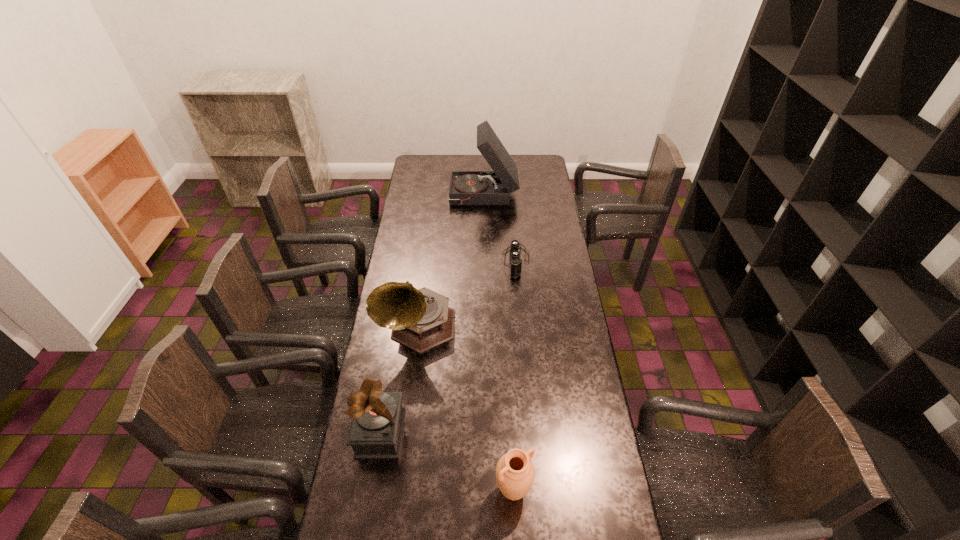
The height and width of the screenshot is (540, 960). Identify the location of object that is the fourth closest to the second farthest phonograph_record. (494, 187).

Where is `phonograph_record that is the second closest one to the binoculars`? The image size is (960, 540). phonograph_record that is the second closest one to the binoculars is located at coordinates (494, 187).

This screenshot has width=960, height=540. What are the coordinates of `phonograph_record that is the closest one to the farthest phonograph_record` in the screenshot? It's located at (420, 319).

Image resolution: width=960 pixels, height=540 pixels. In order to click on free region that satisfies the following two spatial constraints: 1. on the front-facing side of the farthest phonograph_record; 2. on the right side of the second farthest object in this screenshot , I will do (x=485, y=261).

This screenshot has height=540, width=960. In order to click on blank space that satisfies the following two spatial constraints: 1. on the back side of the second shortest object; 2. on the front-facing side of the tallest object in this screenshot , I will do `click(498, 196)`.

The image size is (960, 540). I want to click on vacant region that satisfies the following two spatial constraints: 1. on the front-facing side of the binoculars; 2. on the right side of the tallest object, so click(x=485, y=261).

At what (x,y) coordinates should I click in order to perform the action: click on free space that satisfies the following two spatial constraints: 1. at the horn opening of the second shortest object; 2. on the right side of the second nearest object. Please return your answer as a coordinate pair (x, y). This screenshot has width=960, height=540. Looking at the image, I should click on (371, 491).

The height and width of the screenshot is (540, 960). In order to click on free location that satisfies the following two spatial constraints: 1. on the front-facing side of the farthest object; 2. on the horn direction of the third farthest object in this screenshot , I will do `click(485, 328)`.

Where is `vacant area in the image that satisfies the following two spatial constraints: 1. on the horn direction of the nearest object; 2. on the right side of the third nearest object`? The image size is (960, 540). vacant area in the image that satisfies the following two spatial constraints: 1. on the horn direction of the nearest object; 2. on the right side of the third nearest object is located at coordinates (397, 491).

Identify the location of free space in the image that satisfies the following two spatial constraints: 1. on the front-facing side of the tallest object; 2. on the left side of the fourth nearest object. (485, 261).